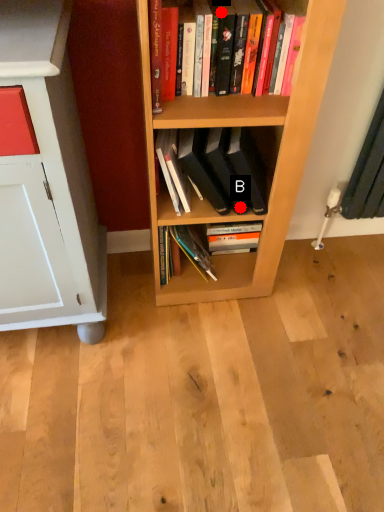
Question: Two points are circled on the image, labeled by A and B beside each circle. Which point is further to the camera?

Choices:
 (A) A is further
 (B) B is further

Answer: (B)